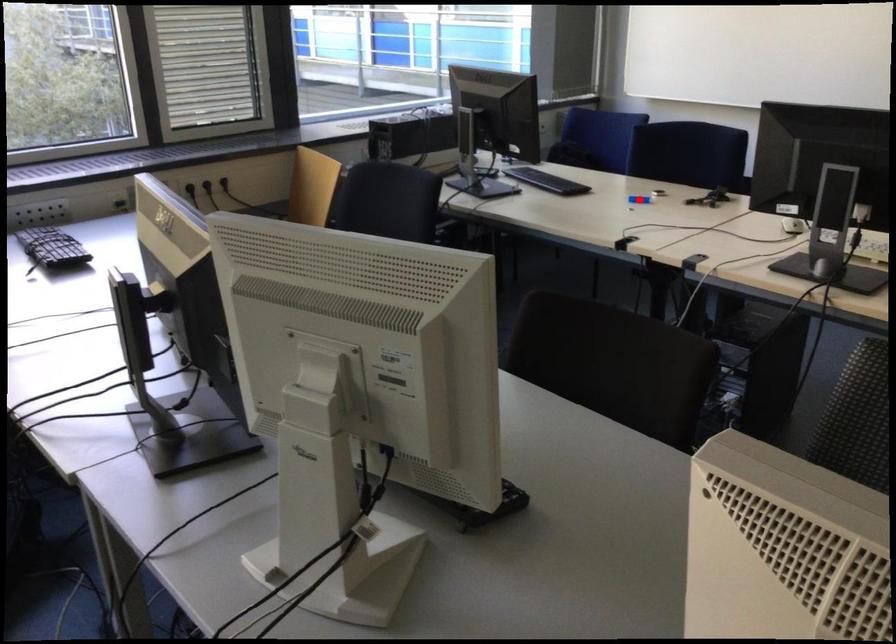
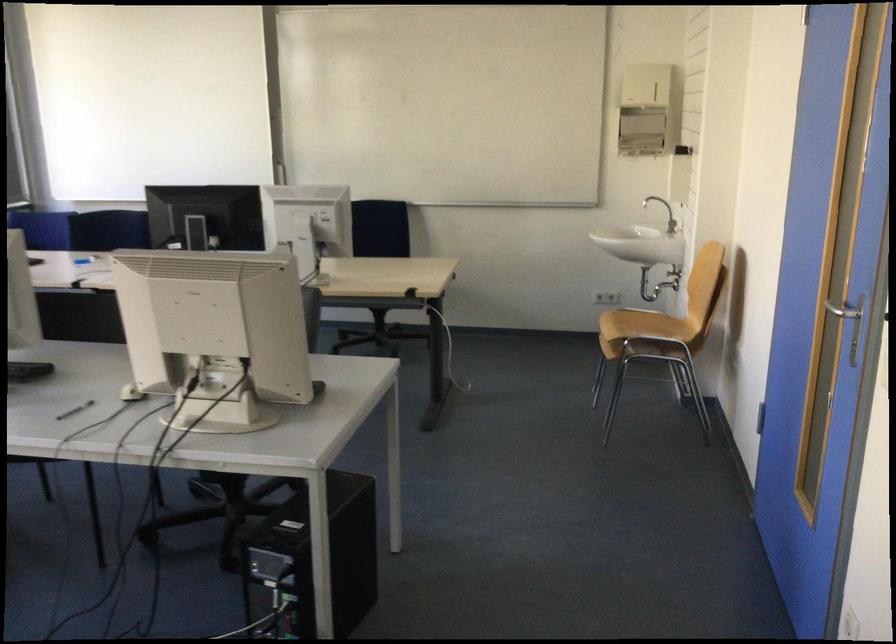
Question: I am providing you with two images of the same scene from different viewpoints. A red point is marked on the first image. Can you still see the location of the red point in image 2?

Choices:
 (A) Yes
 (B) No

Answer: (B)